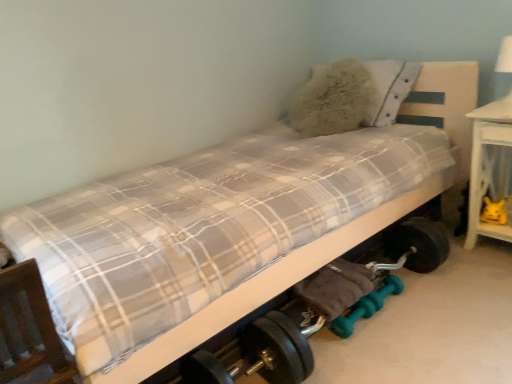
Question: From a real-world perspective, does wooden bed frame at lower left sit lower than teal rubber dumbbells at lower center?

Choices:
 (A) no
 (B) yes

Answer: (A)

Question: Is wooden bed frame at lower left closer to the viewer compared to teal rubber dumbbells at lower center?

Choices:
 (A) no
 (B) yes

Answer: (B)

Question: Considering the relative sizes of wooden bed frame at lower left and teal rubber dumbbells at lower center in the image provided, is wooden bed frame at lower left thinner than teal rubber dumbbells at lower center?

Choices:
 (A) no
 (B) yes

Answer: (B)

Question: Are wooden bed frame at lower left and teal rubber dumbbells at lower center beside each other?

Choices:
 (A) no
 (B) yes

Answer: (A)

Question: Would you say wooden bed frame at lower left is outside teal rubber dumbbells at lower center?

Choices:
 (A) no
 (B) yes

Answer: (B)

Question: Is white glossy table lamp at upper right in front of or behind teal rubber dumbbells at lower center in the image?

Choices:
 (A) front
 (B) behind

Answer: (B)

Question: In terms of width, does white glossy table lamp at upper right look wider or thinner when compared to teal rubber dumbbells at lower center?

Choices:
 (A) wide
 (B) thin

Answer: (B)

Question: Which is correct: white glossy table lamp at upper right is inside teal rubber dumbbells at lower center, or outside of it?

Choices:
 (A) inside
 (B) outside

Answer: (B)

Question: In terms of height, does white glossy table lamp at upper right look taller or shorter compared to teal rubber dumbbells at lower center?

Choices:
 (A) tall
 (B) short

Answer: (A)

Question: Is yellow plush toy at lower right in front of or behind white wood table at right in the image?

Choices:
 (A) front
 (B) behind

Answer: (B)

Question: Visually, is yellow plush toy at lower right positioned to the left or to the right of white wood table at right?

Choices:
 (A) right
 (B) left

Answer: (B)

Question: In terms of size, does yellow plush toy at lower right appear bigger or smaller than white wood table at right?

Choices:
 (A) big
 (B) small

Answer: (B)

Question: Is point pos(485,208) closer or farther from the camera than point pos(474,213)?

Choices:
 (A) closer
 (B) farther

Answer: (B)

Question: Considering the positions of wooden bed frame at lower left and fluffy white pillow at upper right in the image, is wooden bed frame at lower left taller or shorter than fluffy white pillow at upper right?

Choices:
 (A) tall
 (B) short

Answer: (A)

Question: Does point (45, 377) appear closer or farther from the camera than point (330, 120)?

Choices:
 (A) farther
 (B) closer

Answer: (B)